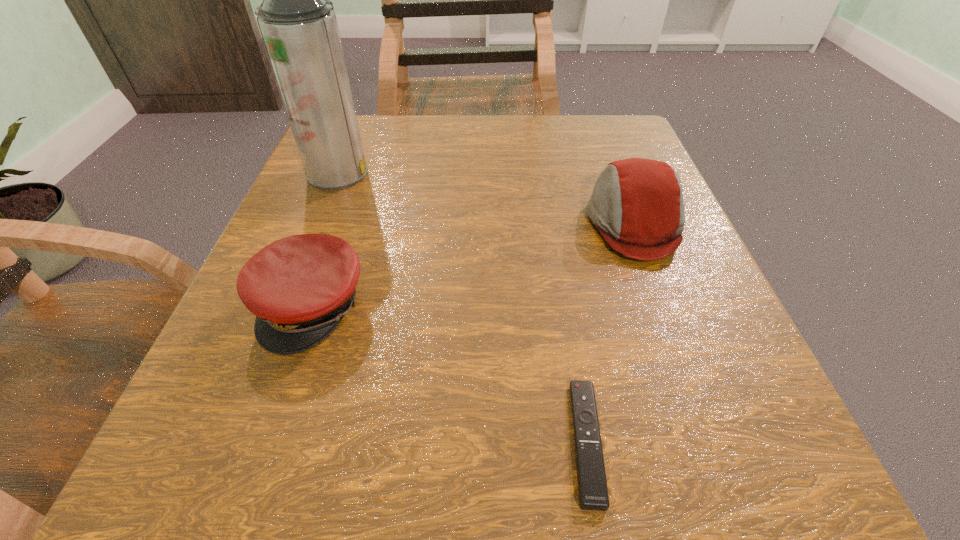
Find the location of `the tallest object`. the tallest object is located at coordinates (298, 24).

Where is `the rightmost object`? The image size is (960, 540). the rightmost object is located at coordinates (637, 204).

I want to click on the second tallest object, so click(637, 204).

This screenshot has width=960, height=540. Find the location of `the third tallest object`. the third tallest object is located at coordinates (300, 287).

You are a GUI agent. You are given a task and a screenshot of the screen. Output one action in this format:
    pyautogui.click(x=<x>, y=<y>)
    Task: Click on the left cap
    
    Given the screenshot: What is the action you would take?
    click(x=300, y=287)

The image size is (960, 540). What are the coordinates of `remote control` in the screenshot? It's located at (592, 485).

The height and width of the screenshot is (540, 960). Identify the location of the third object from left to right. (592, 485).

Find the location of a particular element. The height and width of the screenshot is (540, 960). free space located on the back of the aerosol can is located at coordinates (359, 119).

The width and height of the screenshot is (960, 540). What are the coordinates of `vacant space located on the front-facing side of the rightmost object` in the screenshot? It's located at (492, 223).

The height and width of the screenshot is (540, 960). I want to click on vacant space located on the front-facing side of the rightmost object, so click(x=473, y=223).